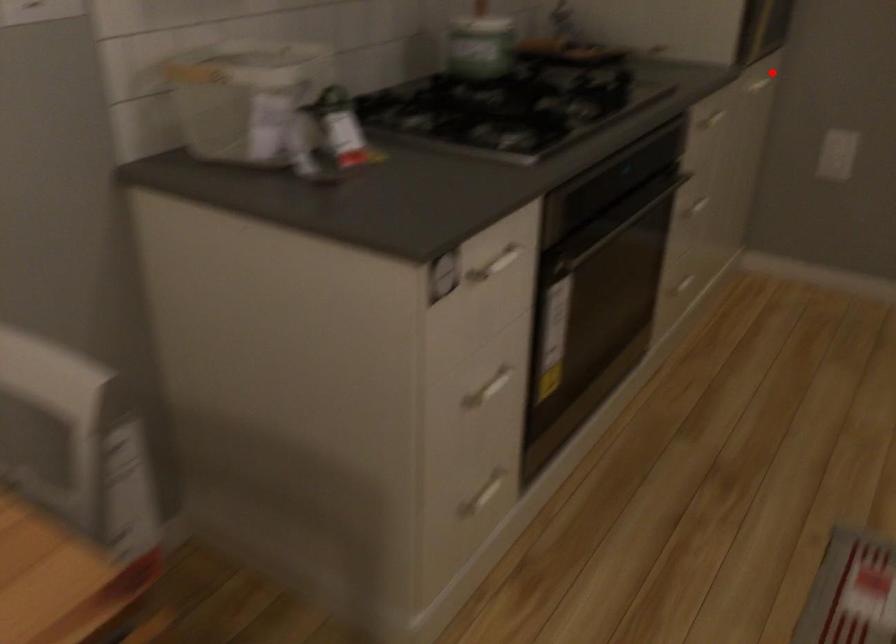
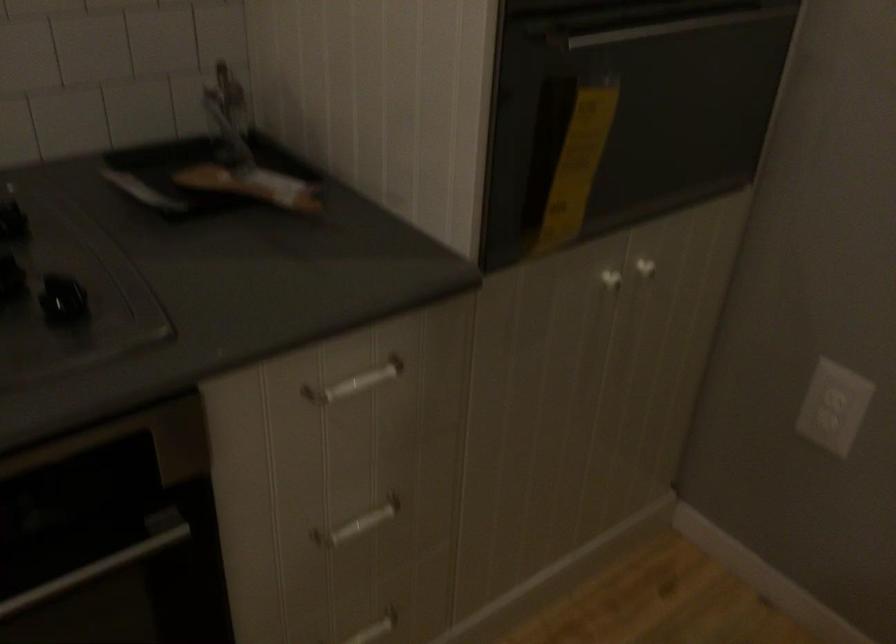
Locate, in the second image, the point that corresponds to the highlighted location in the first image.

(645, 268)